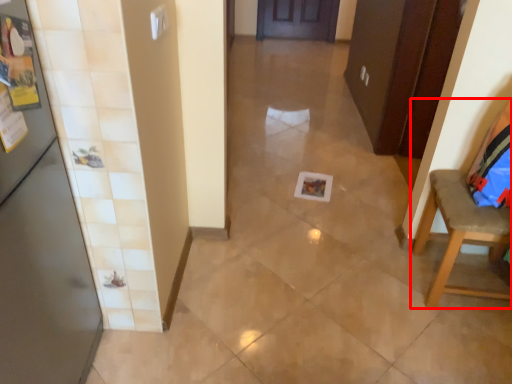
Question: From the image's perspective, what is the correct spatial positioning of chair (annotated by the red box) in reference to door?

Choices:
 (A) below
 (B) above

Answer: (B)